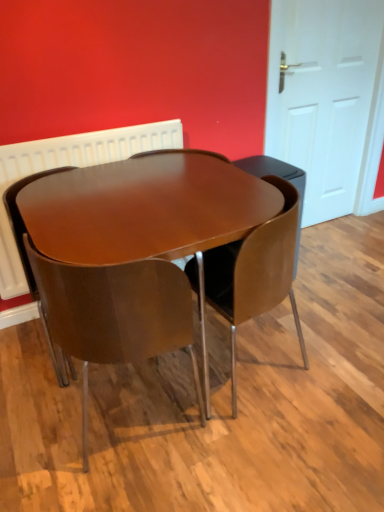
What do you see at coordinates (147, 213) in the screenshot? I see `glossy wood table at center` at bounding box center [147, 213].

Measure the distance between white plastic radiator at upper center and camera.

1.70 meters.

Where is `glossy wood table at center`? The height and width of the screenshot is (512, 384). glossy wood table at center is located at coordinates (147, 213).

Does glossy wood chair at center, which is counted as the third chair, starting from the right, have a lesser height compared to glossy wood table at center?

Incorrect, the height of glossy wood chair at center, which is counted as the third chair, starting from the right, does not fall short of that of glossy wood table at center.

From the image's perspective, which one is positioned lower, glossy wood chair at center, which is counted as the third chair, starting from the right, or glossy wood table at center?

From the image's view, glossy wood table at center is below.

Is glossy wood chair at center, which is counted as the third chair, starting from the right, positioned beyond the bounds of glossy wood table at center?

No, glossy wood chair at center, which is counted as the third chair, starting from the right, is inside or overlapping with glossy wood table at center.

How far apart are glossy wood chair at center, which is counted as the third chair, starting from the right, and glossy wood table at center?

The distance of glossy wood chair at center, which is counted as the third chair, starting from the right, from glossy wood table at center is 14.77 inches.

Who is taller, white glossy door at right or matte brown chair at center, acting as the 2th chair starting from the left?

white glossy door at right.

From the picture: Would you say white glossy door at right is inside or outside matte brown chair at center, acting as the 2th chair starting from the left?

white glossy door at right is not enclosed by matte brown chair at center, acting as the 2th chair starting from the left.

This screenshot has width=384, height=512. In order to click on the 3rd chair in front of the white glossy door at right, counting from the anchor's position in this screenshot , I will do `click(113, 316)`.

From the image's perspective, which is below, white glossy door at right or matte brown chair at center, acting as the 2th chair starting from the left?

matte brown chair at center, acting as the 2th chair starting from the left, appears lower in the image.

From a real-world perspective, is white plastic radiator at upper center positioned under brown leather chair at center, which is the 3th chair from left to right, based on gravity?

No, from a real-world perspective, white plastic radiator at upper center is not below brown leather chair at center, which is the 3th chair from left to right.

Is white plastic radiator at upper center located outside brown leather chair at center, which is the 3th chair from left to right?

Yes, white plastic radiator at upper center is located beyond the bounds of brown leather chair at center, which is the 3th chair from left to right.

Between white plastic radiator at upper center and brown leather chair at center, which is the 3th chair from left to right, which one has smaller width?

Thinner between the two is white plastic radiator at upper center.

This screenshot has height=512, width=384. What are the coordinates of `radiator below the white glossy door at right (from a real-world perspective)` in the screenshot? It's located at (67, 166).

From the image's perspective, is white plastic radiator at upper center over white glossy door at right?

Actually, white plastic radiator at upper center appears below white glossy door at right in the image.

Is white plastic radiator at upper center next to white glossy door at right and touching it?

white plastic radiator at upper center and white glossy door at right are not in contact.

From a real-world perspective, who is located lower, white plastic radiator at upper center or white glossy door at right?

In real-world perspective, white plastic radiator at upper center is lower.

Is glossy wood table at center to the left or to the right of matte brown chair at center, acting as the 2th chair starting from the left, in the image?

glossy wood table at center is positioned on matte brown chair at center, acting as the 2th chair starting from the left,'s right side.

Identify the location of table on the right of matte brown chair at center, acting as the 2th chair starting from the left. (147, 213).

Between glossy wood table at center and matte brown chair at center, acting as the 2th chair starting from the left, which one has larger size?

Bigger between the two is glossy wood table at center.

Consider the image. Would you say glossy wood table at center contains matte brown chair at center, acting as the 2th chair starting from the left?

Yes.

Are glossy wood table at center and white glossy door at right making contact?

glossy wood table at center and white glossy door at right are not in contact.

How far apart are glossy wood table at center and white glossy door at right?

glossy wood table at center and white glossy door at right are 1.17 meters apart from each other.

Is glossy wood table at center oriented towards white glossy door at right?

No.

Is glossy wood table at center inside the boundaries of white glossy door at right, or outside?

glossy wood table at center is not enclosed by white glossy door at right.

This screenshot has height=512, width=384. What are the coordinates of `the 3rd chair in front of the white glossy door at right, starting your count from the anchor` in the screenshot? It's located at (113, 316).

Between point (97, 286) and point (312, 198), which one is positioned in front?

The point (97, 286) is in front.

Can you confirm if matte brown chair at center, acting as the 2th chair starting from the left, is positioned to the left of white glossy door at right?

Indeed, matte brown chair at center, acting as the 2th chair starting from the left, is positioned on the left side of white glossy door at right.

Is there a large distance between matte brown chair at center, the second chair when ordered from right to left, and white glossy door at right?

matte brown chair at center, the second chair when ordered from right to left, is positioned a significant distance from white glossy door at right.

Where is `table below the glossy wood chair at center, which is counted as the third chair, starting from the right (from a real-world perspective)`? This screenshot has width=384, height=512. table below the glossy wood chair at center, which is counted as the third chair, starting from the right (from a real-world perspective) is located at coordinates (147, 213).

Where is `door on the right of the matte brown chair at center, the second chair when ordered from right to left`? door on the right of the matte brown chair at center, the second chair when ordered from right to left is located at coordinates (328, 101).

When comparing their distances from glossy wood chair at center, the first chair in the left-to-right sequence, does white plastic radiator at upper center or glossy wood table at center seem further?

glossy wood table at center lies further to glossy wood chair at center, the first chair in the left-to-right sequence, than the other object.

When comparing their distances from glossy wood table at center, does glossy wood chair at center, the first chair in the left-to-right sequence, or white plastic radiator at upper center seem further?

The object further to glossy wood table at center is white plastic radiator at upper center.

When comparing their distances from glossy wood chair at center, which is counted as the third chair, starting from the right, does matte brown chair at center, acting as the 2th chair starting from the left, or brown leather chair at center, which is the 3th chair from left to right, seem closer?

matte brown chair at center, acting as the 2th chair starting from the left, is closer to glossy wood chair at center, which is counted as the third chair, starting from the right.

Which object lies further to the anchor point white plastic radiator at upper center, brown leather chair at center, which is the 3th chair from left to right, or white glossy door at right?

The object further to white plastic radiator at upper center is white glossy door at right.

Looking at the image, which one is located further to matte brown chair at center, acting as the 2th chair starting from the left, white glossy door at right or white plastic radiator at upper center?

white glossy door at right is positioned further to the anchor matte brown chair at center, acting as the 2th chair starting from the left.

When comparing their distances from glossy wood table at center, does white glossy door at right or matte brown chair at center, acting as the 2th chair starting from the left, seem further?

white glossy door at right is positioned further to the anchor glossy wood table at center.

From the picture: Considering their positions, is white glossy door at right positioned further to glossy wood table at center than white plastic radiator at upper center?

Based on the image, white glossy door at right appears to be further to glossy wood table at center.

When comparing their distances from brown leather chair at center, which is counted as the first chair, starting from the right, does glossy wood chair at center, the first chair in the left-to-right sequence, or glossy wood table at center seem further?

glossy wood chair at center, the first chair in the left-to-right sequence, is positioned further to the anchor brown leather chair at center, which is counted as the first chair, starting from the right.

Locate an element on the screen. The height and width of the screenshot is (512, 384). table between glossy wood chair at center, the first chair in the left-to-right sequence, and brown leather chair at center, which is counted as the first chair, starting from the right, in the horizontal direction is located at coordinates (147, 213).

Where is `table positioned between matte brown chair at center, acting as the 2th chair starting from the left, and glossy wood chair at center, which is counted as the third chair, starting from the right, from near to far`? The height and width of the screenshot is (512, 384). table positioned between matte brown chair at center, acting as the 2th chair starting from the left, and glossy wood chair at center, which is counted as the third chair, starting from the right, from near to far is located at coordinates (147, 213).

Identify the location of radiator between glossy wood chair at center, the first chair in the left-to-right sequence, and brown leather chair at center, which is counted as the first chair, starting from the right. (67, 166).

Find the location of `radiator located between glossy wood chair at center, which is counted as the third chair, starting from the right, and white glossy door at right in the left-right direction`. radiator located between glossy wood chair at center, which is counted as the third chair, starting from the right, and white glossy door at right in the left-right direction is located at coordinates (67, 166).